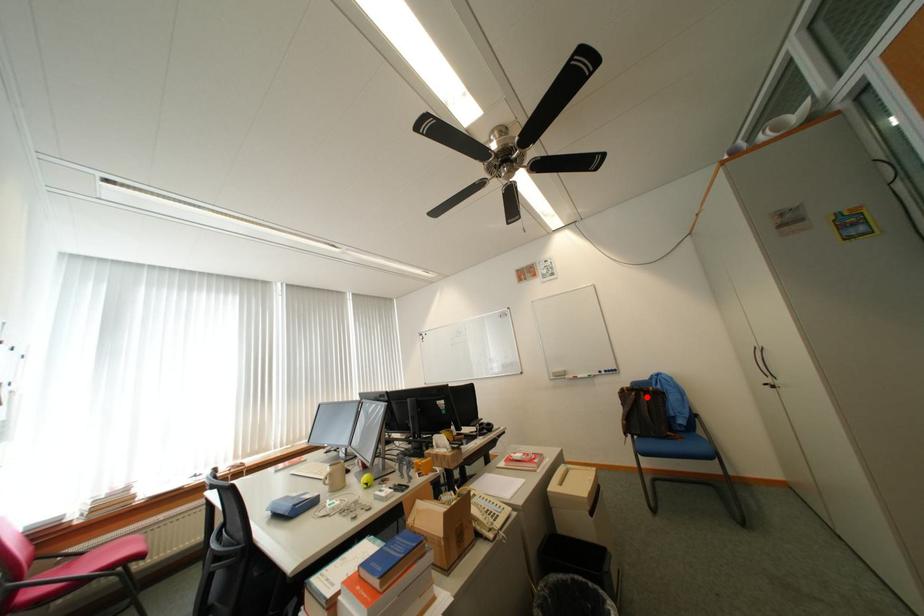
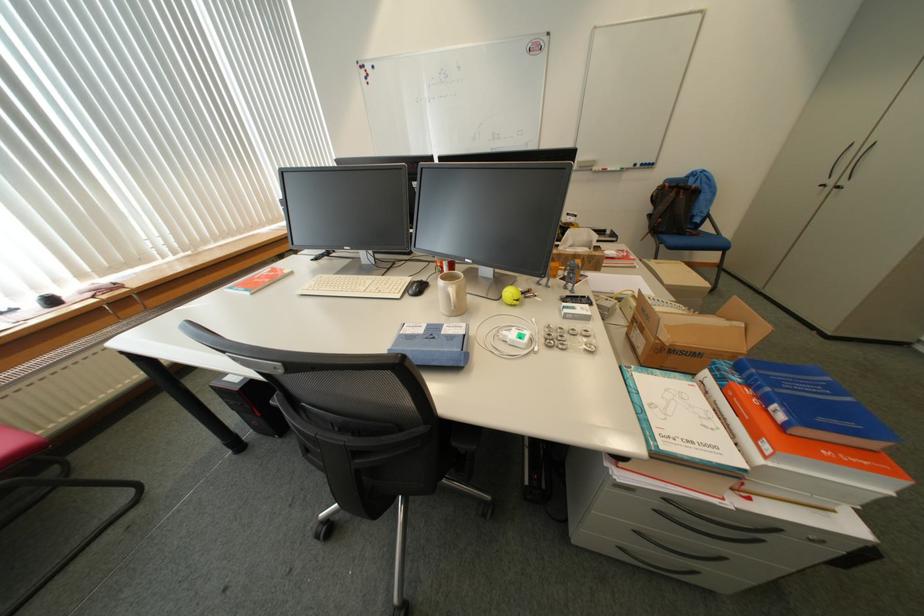
Question: I am providing you with two images of the same scene from different viewpoints. In image1, a red point is highlighted. Considering the same 3D point in image2, which of the following is correct?

Choices:
 (A) It is closer
 (B) It is farther

Answer: (A)